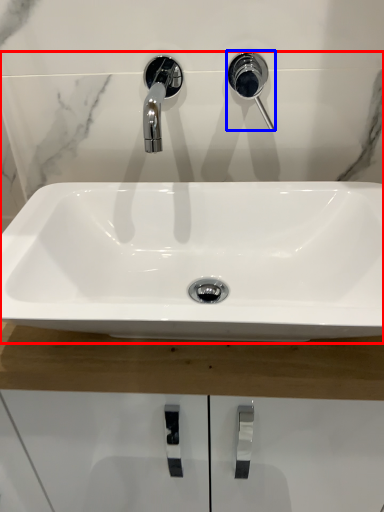
Question: Among these objects, which one is nearest to the camera, sink (highlighted by a red box) or plumbing fixture (highlighted by a blue box)?

Choices:
 (A) sink
 (B) plumbing fixture

Answer: (A)